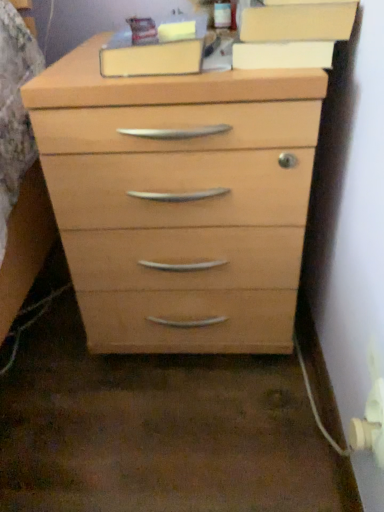
The image size is (384, 512). What do you see at coordinates (173, 154) in the screenshot?
I see `light wood chest of drawers at center` at bounding box center [173, 154].

At what (x,y) coordinates should I click in order to perform the action: click on light wood chest of drawers at center. Please return your answer as a coordinate pair (x, y). Looking at the image, I should click on (173, 154).

What do you see at coordinates (298, 23) in the screenshot? The width and height of the screenshot is (384, 512). I see `matte wood cabinet at upper center` at bounding box center [298, 23].

Where is `matte wood cabinet at upper center`? The height and width of the screenshot is (512, 384). matte wood cabinet at upper center is located at coordinates (298, 23).

Locate an element on the screen. This screenshot has height=512, width=384. light wood chest of drawers at center is located at coordinates (173, 154).

Based on their positions, is light wood chest of drawers at center located to the left or right of matte wood cabinet at upper center?

light wood chest of drawers at center is to the left of matte wood cabinet at upper center.

Is the depth of light wood chest of drawers at center greater than that of matte wood cabinet at upper center?

No, light wood chest of drawers at center is closer to the viewer.

Is point (47, 134) closer or farther from the camera than point (240, 29)?

Clearly, point (47, 134) is more distant from the camera than point (240, 29).

From the image's perspective, is light wood chest of drawers at center above matte wood cabinet at upper center?

No.

From a real-world perspective, is light wood chest of drawers at center positioned over matte wood cabinet at upper center based on gravity?

No, from a real-world perspective, light wood chest of drawers at center is not on top of matte wood cabinet at upper center.

Looking at their sizes, would you say light wood chest of drawers at center is wider or thinner than matte wood cabinet at upper center?

Considering their sizes, light wood chest of drawers at center looks broader than matte wood cabinet at upper center.

Considering the sizes of objects light wood chest of drawers at center and matte wood cabinet at upper center in the image provided, who is taller, light wood chest of drawers at center or matte wood cabinet at upper center?

With more height is light wood chest of drawers at center.

Considering the relative sizes of light wood chest of drawers at center and matte wood cabinet at upper center in the image provided, is light wood chest of drawers at center bigger than matte wood cabinet at upper center?

Indeed, light wood chest of drawers at center has a larger size compared to matte wood cabinet at upper center.

Do you think light wood chest of drawers at center is within matte wood cabinet at upper center, or outside of it?

light wood chest of drawers at center cannot be found inside matte wood cabinet at upper center.

Is light wood chest of drawers at center far away from matte wood cabinet at upper center?

No.

Is light wood chest of drawers at center positioned with its back to matte wood cabinet at upper center?

No, light wood chest of drawers at center's orientation is not away from matte wood cabinet at upper center.

How different are the orientations of light wood chest of drawers at center and matte wood cabinet at upper center in degrees?

0.437 degrees.

Where is `chest of drawers on the left of matte wood cabinet at upper center`? Image resolution: width=384 pixels, height=512 pixels. chest of drawers on the left of matte wood cabinet at upper center is located at coordinates (173, 154).

Between matte wood cabinet at upper center and light wood chest of drawers at center, which one appears on the right side from the viewer's perspective?

matte wood cabinet at upper center is more to the right.

Is matte wood cabinet at upper center in front of light wood chest of drawers at center?

No, it is not.

Between point (298, 23) and point (97, 236), which one is positioned behind?

The point (97, 236) is farther from the camera.

From the image's perspective, does matte wood cabinet at upper center appear higher than light wood chest of drawers at center?

Yes, from the image's perspective, matte wood cabinet at upper center is above light wood chest of drawers at center.

In the scene shown: From a real-world perspective, is matte wood cabinet at upper center positioned above or below light wood chest of drawers at center?

matte wood cabinet at upper center is situated higher than light wood chest of drawers at center in the real world.

Is matte wood cabinet at upper center wider than light wood chest of drawers at center?

No, matte wood cabinet at upper center is not wider than light wood chest of drawers at center.

Is matte wood cabinet at upper center taller than light wood chest of drawers at center?

No, matte wood cabinet at upper center is not taller than light wood chest of drawers at center.

Considering the relative sizes of matte wood cabinet at upper center and light wood chest of drawers at center in the image provided, is matte wood cabinet at upper center smaller than light wood chest of drawers at center?

Yes.

Is matte wood cabinet at upper center surrounding light wood chest of drawers at center?

Actually, light wood chest of drawers at center is outside matte wood cabinet at upper center.

Is matte wood cabinet at upper center positioned far away from light wood chest of drawers at center?

No, there isn't a large distance between matte wood cabinet at upper center and light wood chest of drawers at center.

Is matte wood cabinet at upper center aimed at light wood chest of drawers at center?

No, matte wood cabinet at upper center is not facing towards light wood chest of drawers at center.

Looking at this image, can you tell me how much matte wood cabinet at upper center and light wood chest of drawers at center differ in facing direction?

The angular difference between matte wood cabinet at upper center and light wood chest of drawers at center is 0.437 degrees.

How much distance is there between matte wood cabinet at upper center and light wood chest of drawers at center?

They are 8.87 inches apart.

At what (x,y) coordinates should I click in order to perform the action: click on the chest of drawers directly beneath the matte wood cabinet at upper center (from a real-world perspective). Please return your answer as a coordinate pair (x, y). Looking at the image, I should click on (173, 154).

Locate an element on the screen. the chest of drawers that appears below the matte wood cabinet at upper center (from a real-world perspective) is located at coordinates (173, 154).

In the image, there is a light wood chest of drawers at center. Where is `cabinetry above it (from the image's perspective)`? Image resolution: width=384 pixels, height=512 pixels. cabinetry above it (from the image's perspective) is located at coordinates (298, 23).